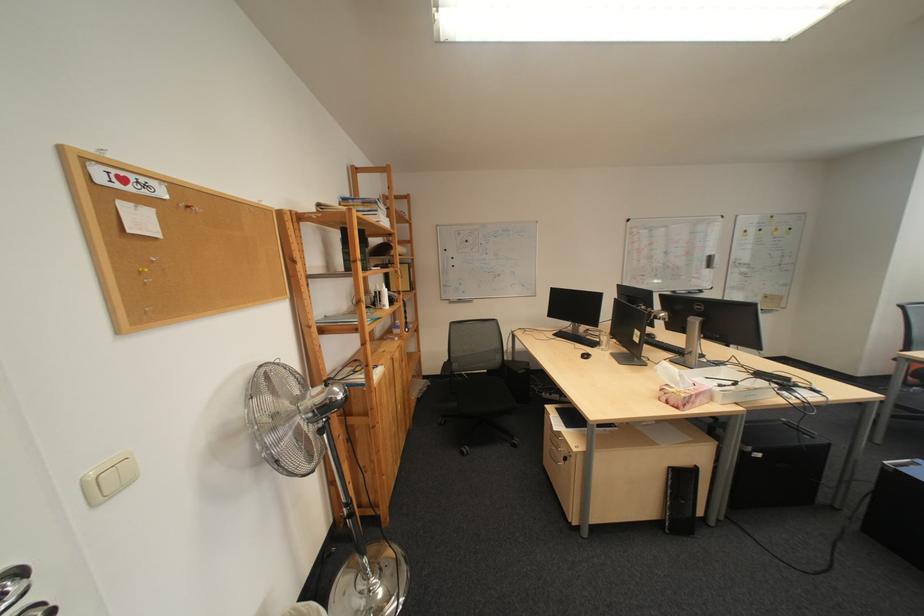
This screenshot has height=616, width=924. In order to click on white light switch in this screenshot , I will do `click(108, 479)`.